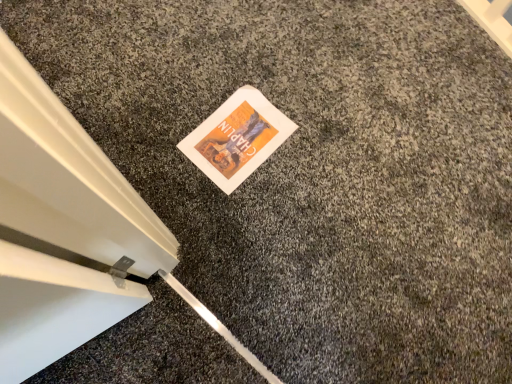
Where is `vacant space situated on the left part of white paper at center`? This screenshot has width=512, height=384. vacant space situated on the left part of white paper at center is located at coordinates (158, 121).